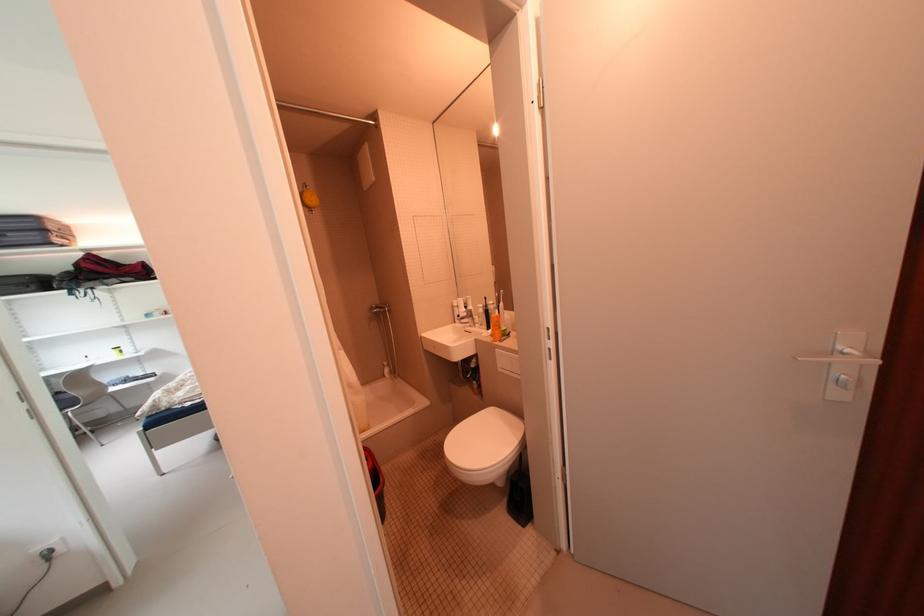
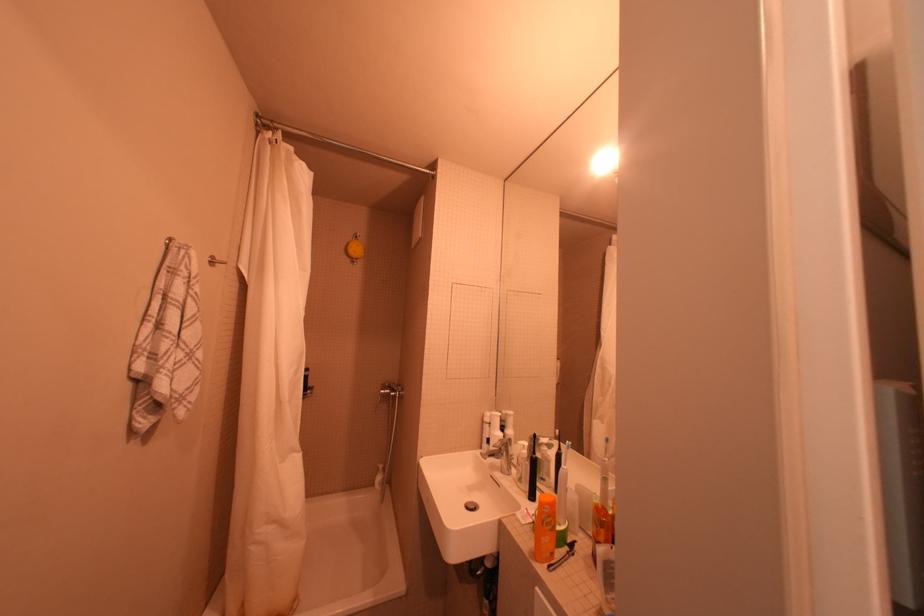
Question: Which direction would the cameraman need to move to produce the second image? Reply with the corresponding letter.

Choices:
 (A) Left
 (B) Right
 (C) Forward
 (D) Backward

Answer: (C)